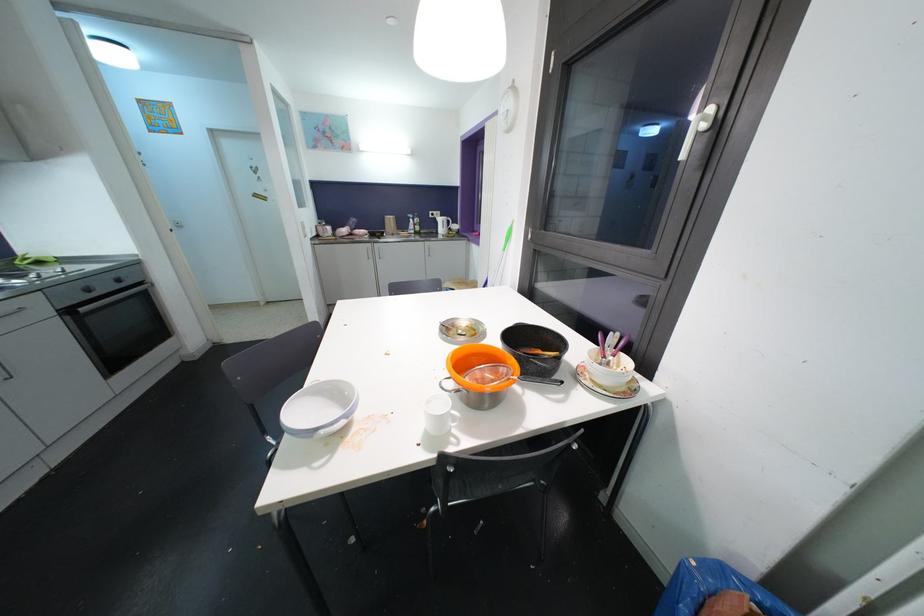
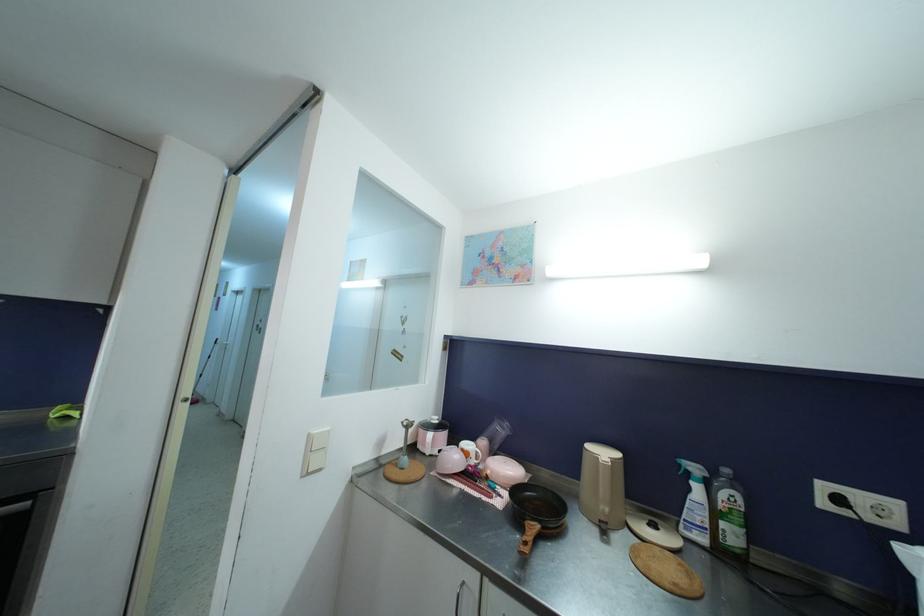
Question: I am providing you with two images of the same scene from different viewpoints. After the viewpoint changes to image2, which objects are now occluded?

Choices:
 (A) white light switch
 (B) silver immersion blender
 (C) pink bowl
 (D) none of these

Answer: (D)